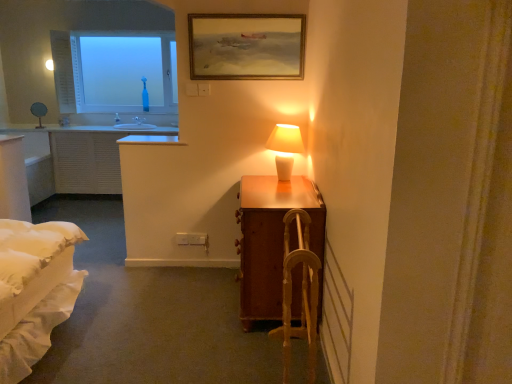
Question: Considering the relative sizes of wooden framed painting at upper center and wooden suitcase at right in the image provided, is wooden framed painting at upper center wider than wooden suitcase at right?

Choices:
 (A) yes
 (B) no

Answer: (B)

Question: From the image's perspective, is wooden framed painting at upper center over wooden suitcase at right?

Choices:
 (A) yes
 (B) no

Answer: (A)

Question: Does wooden framed painting at upper center come in front of wooden suitcase at right?

Choices:
 (A) yes
 (B) no

Answer: (B)

Question: From a real-world perspective, does wooden framed painting at upper center sit lower than wooden suitcase at right?

Choices:
 (A) yes
 (B) no

Answer: (B)

Question: Does wooden framed painting at upper center have a lesser height compared to wooden suitcase at right?

Choices:
 (A) no
 (B) yes

Answer: (B)

Question: Is wooden suitcase at right completely or partially inside wooden framed painting at upper center?

Choices:
 (A) yes
 (B) no

Answer: (B)

Question: Is wooden armchair at center at the left side of white ceramic lamp at upper right?

Choices:
 (A) no
 (B) yes

Answer: (B)

Question: Considering the relative positions of wooden armchair at center and white ceramic lamp at upper right in the image provided, is wooden armchair at center behind white ceramic lamp at upper right?

Choices:
 (A) yes
 (B) no

Answer: (B)

Question: Does wooden armchair at center come in front of white ceramic lamp at upper right?

Choices:
 (A) yes
 (B) no

Answer: (A)

Question: Is wooden armchair at center not inside white ceramic lamp at upper right?

Choices:
 (A) yes
 (B) no

Answer: (A)

Question: Could you tell me if wooden armchair at center is facing white ceramic lamp at upper right?

Choices:
 (A) no
 (B) yes

Answer: (A)

Question: Can you confirm if wooden armchair at center is smaller than white ceramic lamp at upper right?

Choices:
 (A) no
 (B) yes

Answer: (A)

Question: Considering the relative positions of wooden armchair at center and wooden suitcase at right in the image provided, is wooden armchair at center to the left of wooden suitcase at right from the viewer's perspective?

Choices:
 (A) no
 (B) yes

Answer: (A)